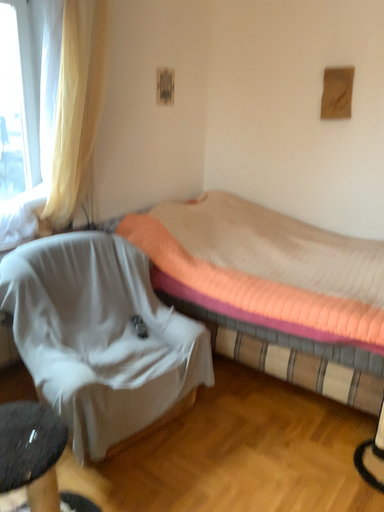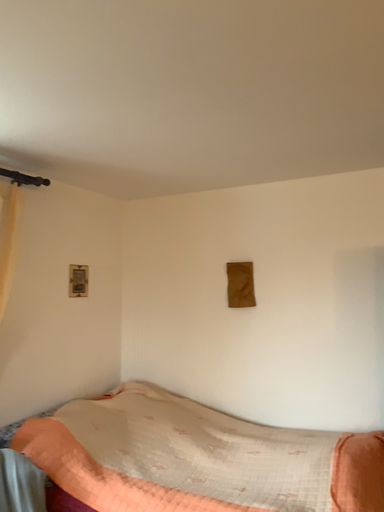
Question: How did the camera likely rotate when shooting the video?

Choices:
 (A) rotated downward
 (B) rotated upward

Answer: (B)